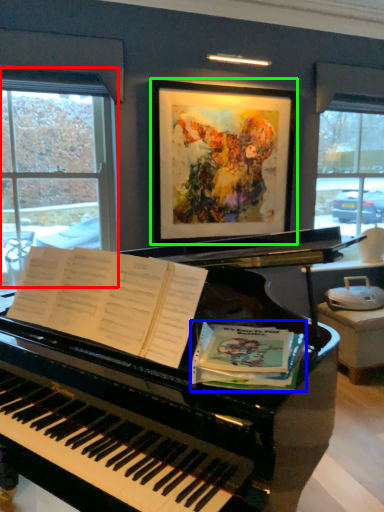
Question: Considering the real-world distances, which object is closest to window (highlighted by a red box)? paperback book (highlighted by a blue box) or picture frame (highlighted by a green box).

Choices:
 (A) paperback book
 (B) picture frame

Answer: (B)